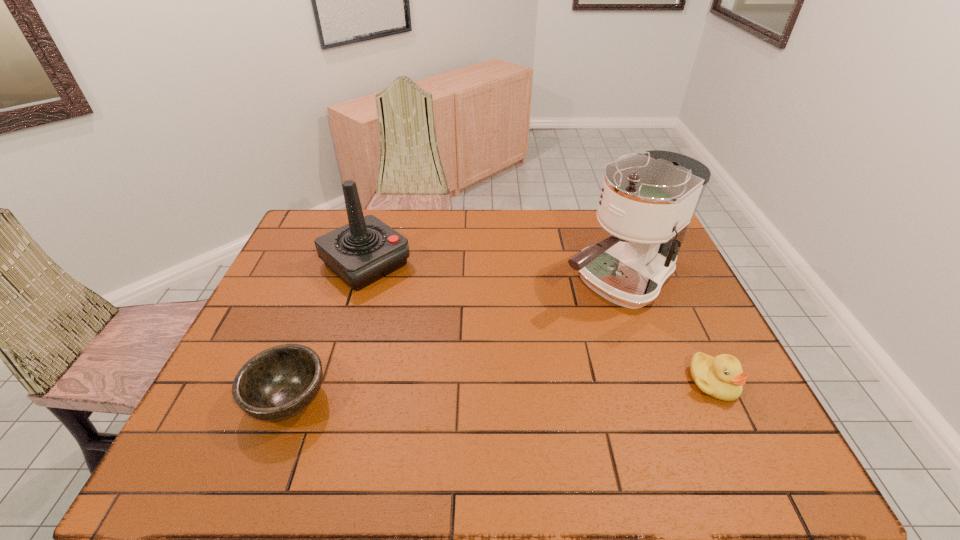
This screenshot has height=540, width=960. I want to click on object that is positioned at the near left corner, so click(278, 383).

Find the location of a particular element. This screenshot has height=540, width=960. object that is at the far right corner is located at coordinates (647, 202).

You are a GUI agent. You are given a task and a screenshot of the screen. Output one action in this format:
    pyautogui.click(x=<x>, y=<y>)
    Task: Click on the object that is at the near right corner
    The image size is (960, 540).
    Given the screenshot: What is the action you would take?
    pyautogui.click(x=721, y=377)

I want to click on free space at the far edge of the desktop, so click(x=380, y=219).

Where is `free space at the near edge of the desktop`? The image size is (960, 540). free space at the near edge of the desktop is located at coordinates (362, 401).

Where is `free space at the left edge`? Image resolution: width=960 pixels, height=540 pixels. free space at the left edge is located at coordinates pos(281,292).

In the image, there is a desktop. At what (x,y) coordinates should I click in order to perform the action: click on free region at the right edge. Please return your answer as a coordinate pair (x, y). The image size is (960, 540). Looking at the image, I should click on (681, 316).

In the image, there is a desktop. Where is `free region at the far left corner`? The image size is (960, 540). free region at the far left corner is located at coordinates (307, 241).

Identify the location of empty space between the coffee maker and the joystick. (492, 272).

Locate an element on the screen. Image resolution: width=960 pixels, height=540 pixels. free point between the second tallest object and the bowl is located at coordinates (327, 331).